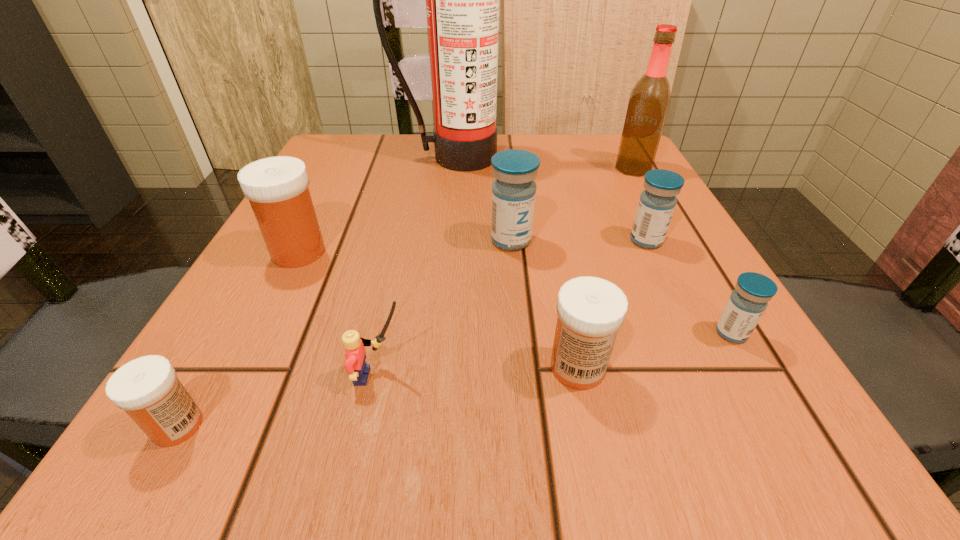
This screenshot has height=540, width=960. I want to click on red fire extinguisher, so click(462, 0).

Find the location of a particular element. fire extinguisher is located at coordinates (462, 0).

You are a GUI agent. You are given a task and a screenshot of the screen. Output one action in this format:
    pyautogui.click(x=<x>, y=<y>)
    Task: Click on the beer bottle
    
    Given the screenshot: What is the action you would take?
    pyautogui.click(x=650, y=98)

Identify the location of the leftmost blue medicine. pyautogui.click(x=514, y=190).

You are a GUI agent. You are given a task and a screenshot of the screen. Output one action in this format:
    pyautogui.click(x=<x>, y=<y>)
    Task: Click on the farthest white medicine
    This screenshot has height=540, width=960.
    Given the screenshot: What is the action you would take?
    pyautogui.click(x=277, y=188)

At what (x,y) coordinates should I click in order to perform the action: click on the second blue medicine from left to right. Please return your answer as a coordinate pair (x, y). The image size is (960, 540). Looking at the image, I should click on tap(657, 202).

You are a GUI agent. You are given a task and a screenshot of the screen. Output one action in this format:
    pyautogui.click(x=<x>, y=<y>)
    Task: Click on the fifth medicine from left to right
    This screenshot has width=960, height=540.
    Given the screenshot: What is the action you would take?
    coord(657,202)

The height and width of the screenshot is (540, 960). I want to click on the second farthest white medicine, so click(591, 310).

Locate an element on the screen. the rightmost white medicine is located at coordinates (591, 310).

Image resolution: width=960 pixels, height=540 pixels. I want to click on yellow Lego, so click(x=355, y=354).